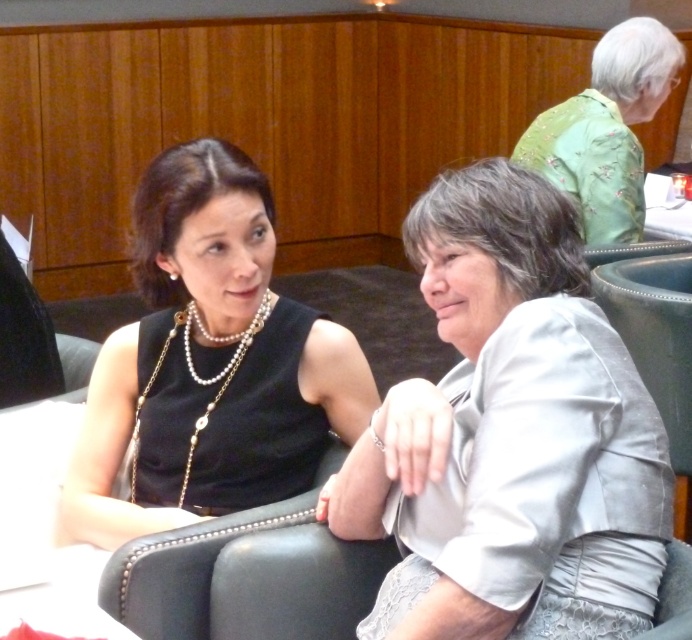
You are standing in a room where the image is displayed. The satin gray blouse at center is located at coordinates point 0.683, 0.738. If you were to walk directly towards the blouse, which direction should you move from your current position?

The satin gray blouse at center is located at point (509,436), so you should move towards the coordinates (509,436) to reach it.